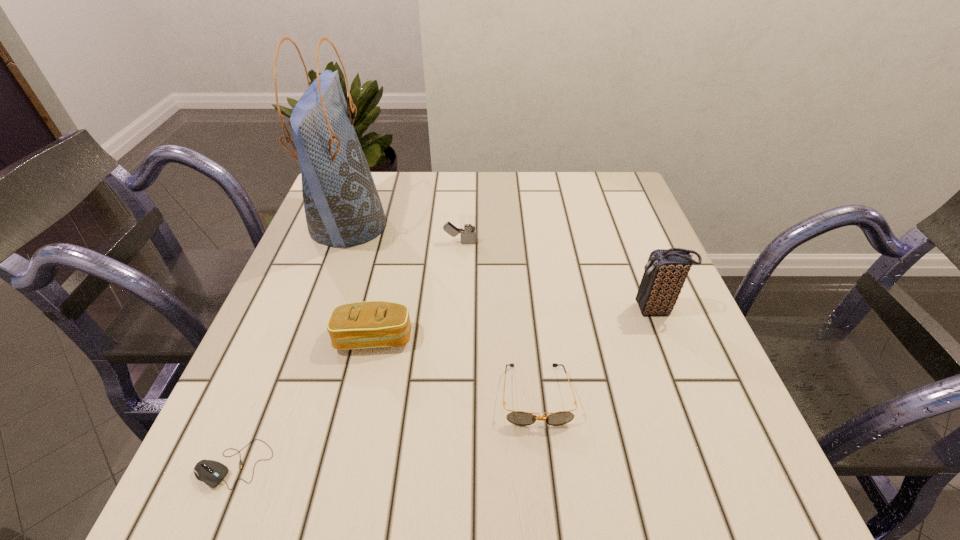
Locate an element on the screen. This screenshot has width=960, height=540. vacant space at the near left corner of the desktop is located at coordinates (228, 455).

The image size is (960, 540). I want to click on free space at the far right corner, so point(610,199).

Where is `vacant space at the near right corner of the desktop`? This screenshot has width=960, height=540. vacant space at the near right corner of the desktop is located at coordinates (686, 471).

In order to click on vacant area that lies between the igniter and the second object from right to left in this screenshot , I will do `click(498, 319)`.

This screenshot has height=540, width=960. In order to click on unoccupied position between the fourth object from left to right and the computer mouse in this screenshot , I will do (348, 353).

At what (x,y) coordinates should I click in order to perform the action: click on vacant point located between the second object from right to left and the shopping bag. Please return your answer as a coordinate pair (x, y). Looking at the image, I should click on (443, 310).

Locate an element on the screen. Image resolution: width=960 pixels, height=540 pixels. vacant area that lies between the sunglasses and the shopping bag is located at coordinates (443, 310).

The image size is (960, 540). I want to click on vacant point located between the taller clutch bag and the tallest object, so coord(502,267).

I want to click on empty location between the igniter and the left clutch bag, so click(418, 291).

Image resolution: width=960 pixels, height=540 pixels. I want to click on free spot between the third object from right to left and the tallest object, so click(x=404, y=234).